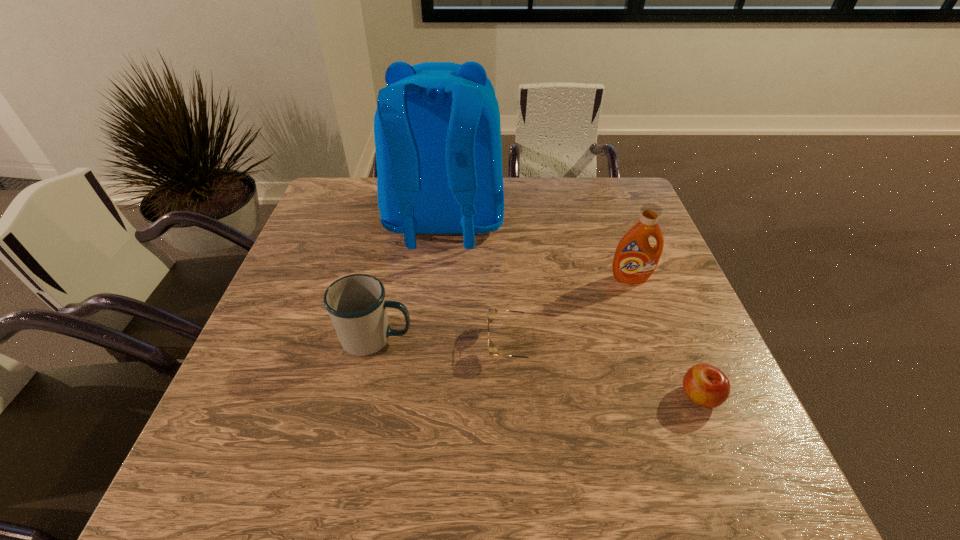
Locate an element on the screen. The image size is (960, 540). vacant space at the left edge is located at coordinates (300, 252).

The height and width of the screenshot is (540, 960). In the image, there is a desktop. In order to click on vacant space at the right edge in this screenshot , I will do `click(699, 415)`.

I want to click on vacant space at the far left corner, so click(x=347, y=219).

At what (x,y) coordinates should I click in order to perform the action: click on free space at the near left corner of the desktop. Please return your answer as a coordinate pair (x, y). The image size is (960, 540). Looking at the image, I should click on (259, 473).

Locate an element on the screen. The width and height of the screenshot is (960, 540). free space at the near right corner of the desktop is located at coordinates (715, 457).

Find the location of a particular element. This screenshot has width=960, height=540. free spot between the third tallest object and the farthest object is located at coordinates (410, 280).

This screenshot has height=540, width=960. Find the location of `vacant space that is in between the detergent and the shortest object`. vacant space that is in between the detergent and the shortest object is located at coordinates (571, 311).

Find the location of `vacant area that lies between the second farthest object and the shortest object`. vacant area that lies between the second farthest object and the shortest object is located at coordinates click(x=571, y=311).

Identify the location of free point between the sunglasses and the detergent. (571, 311).

Image resolution: width=960 pixels, height=540 pixels. I want to click on vacant area between the nearest object and the mug, so click(538, 367).